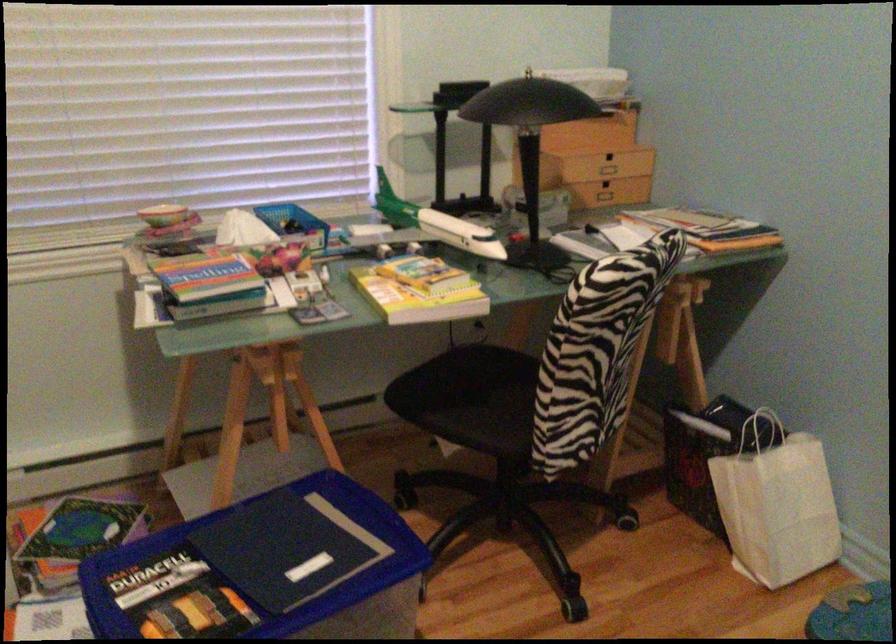
Find where to lift the small colorful bowl. Please return your answer as a coordinate pair (x, y).

(164, 214)